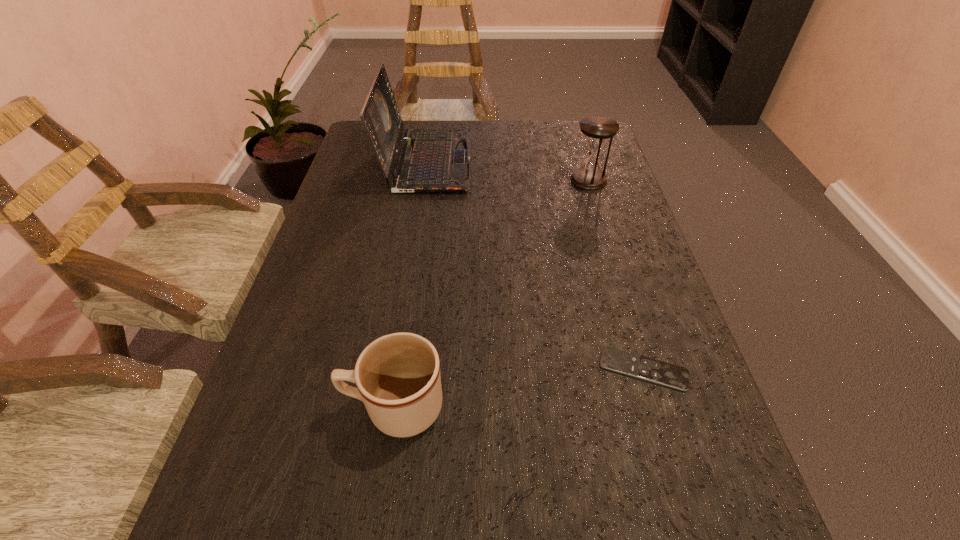
The image size is (960, 540). Find the location of `laptop computer`. laptop computer is located at coordinates (431, 160).

Locate an element on the screen. The height and width of the screenshot is (540, 960). hourglass is located at coordinates (597, 129).

Find the location of a particular element. the second shortest object is located at coordinates pyautogui.click(x=398, y=379).

You are a GUI agent. You are given a task and a screenshot of the screen. Output one action in this format:
    pyautogui.click(x=<x>, y=<y>)
    Task: Click on the remote control
    
    Given the screenshot: What is the action you would take?
    pyautogui.click(x=659, y=372)

Where is `vacant area situated on the screen of the laptop computer`? The height and width of the screenshot is (540, 960). vacant area situated on the screen of the laptop computer is located at coordinates pos(526,161).

Identify the location of vacant area situated 0.050m on the left of the third shortest object. (552, 180).

Image resolution: width=960 pixels, height=540 pixels. I want to click on vacant space positioned 0.050m on the side of the second shortest object with the handle, so click(315, 407).

What are the coordinates of `free point located 0.120m on the side of the second shortest object with the handle` in the screenshot? It's located at (273, 407).

You are a GUI agent. You are given a task and a screenshot of the screen. Output one action in this format:
    pyautogui.click(x=<x>, y=<y>)
    Task: Click on the free space located 0.390m on the left of the remote control
    The width and height of the screenshot is (960, 540).
    Given the screenshot: What is the action you would take?
    pyautogui.click(x=382, y=369)

I want to click on object that is at the far edge, so click(x=431, y=160).